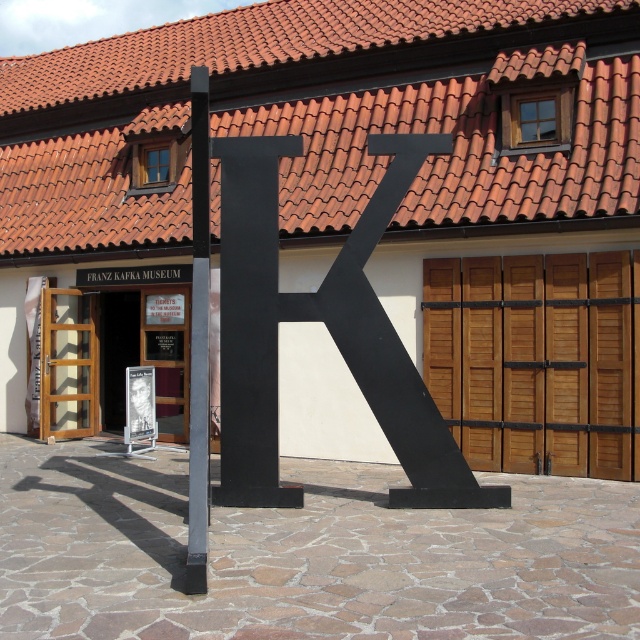
You are a visitor approaching the Franz Kafka Museum and notice the red clay tiles at upper center and the metallic gray pole at center. Which object is located higher from the ground?

The red clay tiles at upper center are positioned over the metallic gray pole at center, so they are higher up.